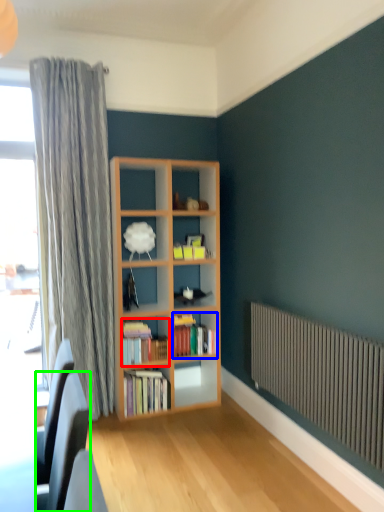
Question: Based on their relative distances, which object is farther from book (highlighted by a red box)? Choose from book (highlighted by a blue box) and swivel chair (highlighted by a green box).

Choices:
 (A) book
 (B) swivel chair

Answer: (B)